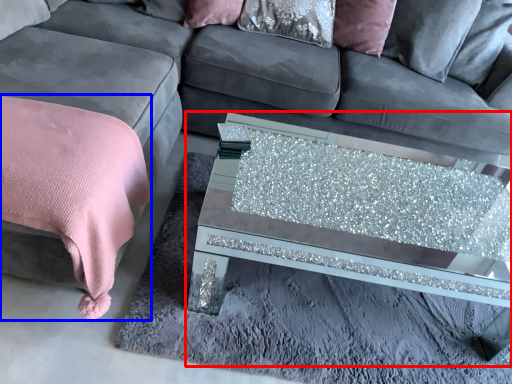
Question: Which of the following is the farthest to the observer, coffee table (highlighted by a red box) or blanket (highlighted by a blue box)?

Choices:
 (A) coffee table
 (B) blanket

Answer: (A)